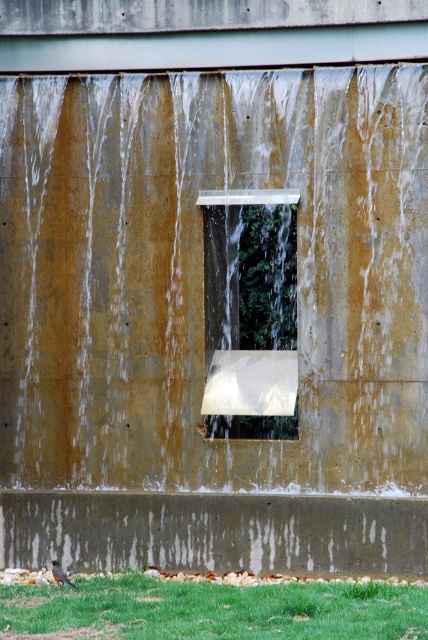
Question: Considering the real-world distances, which object is closest to the clear glass window at center?

Choices:
 (A) green grass at lower center
 (B) clear concrete waterfall at center

Answer: (B)

Question: Which object appears farthest from the camera in this image?

Choices:
 (A) clear glass window at center
 (B) green grass at lower center

Answer: (A)

Question: Among these objects, which one is farthest from the camera?

Choices:
 (A) concrete rough at lower center
 (B) clear concrete waterfall at center

Answer: (B)

Question: Can you confirm if concrete rough at lower center is positioned to the right of green grass at lower center?

Choices:
 (A) yes
 (B) no

Answer: (B)

Question: Is concrete rough at lower center below clear glass window at center?

Choices:
 (A) yes
 (B) no

Answer: (A)

Question: Can you confirm if clear concrete waterfall at center is wider than clear glass window at center?

Choices:
 (A) no
 (B) yes

Answer: (B)